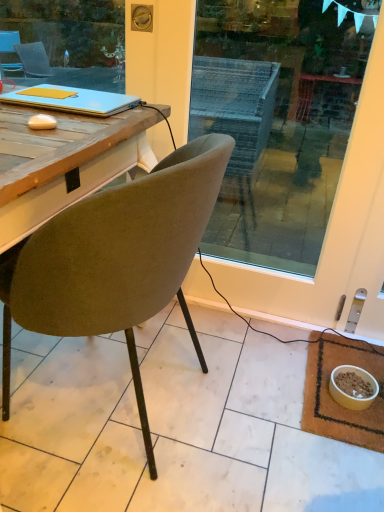
Where is `vacant area that is in front of yellow matte bowl at lower right`? vacant area that is in front of yellow matte bowl at lower right is located at coordinates (350, 429).